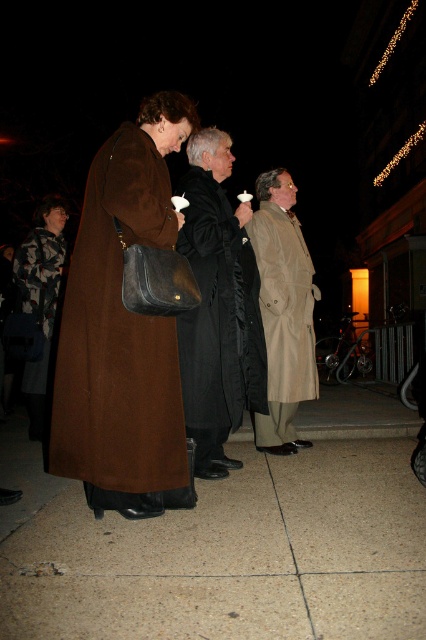
Which is behind, point (189, 497) or point (206, 138)?

Point (206, 138)

The width and height of the screenshot is (426, 640). Find the location of `brown wool coat at left`. brown wool coat at left is located at coordinates (123, 330).

Who is more distant from viewer, (115, 280) or (247, 321)?

Point (247, 321)

The width and height of the screenshot is (426, 640). I want to click on brown wool coat at left, so coord(123,330).

Who is positioned more to the left, brown polished stone pavement at center or black wool coat at center?

black wool coat at center

Who is taller, brown polished stone pavement at center or black wool coat at center?

Standing taller between the two is black wool coat at center.

Who is more forward, (x=382, y=586) or (x=247, y=346)?

Point (x=382, y=586) is in front.

Locate an element on the screen. The width and height of the screenshot is (426, 640). brown polished stone pavement at center is located at coordinates (233, 556).

Who is more distant from viewer, [198,234] or [43,321]?

Positioned behind is point [43,321].

Consider the image. Is black wool coat at center shorter than camouflage fabric jacket at lower left?

Incorrect, black wool coat at center's height does not fall short of camouflage fabric jacket at lower left's.

Which is in front, point (252, 387) or point (31, 252)?

Point (252, 387) is in front.

This screenshot has width=426, height=640. Identify the location of black wool coat at center. (x=218, y=308).